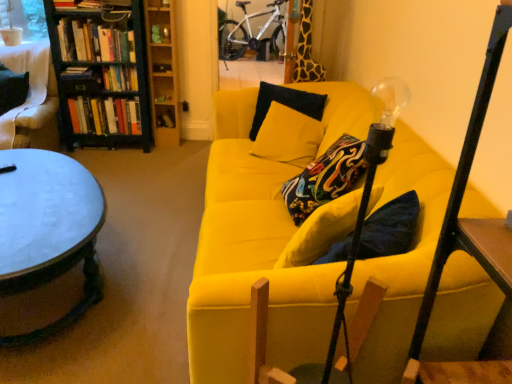
Question: Can you confirm if metallic round table at left is shorter than white matte bicycle at upper center?

Choices:
 (A) no
 (B) yes

Answer: (B)

Question: Is metallic round table at left at the right side of white matte bicycle at upper center?

Choices:
 (A) yes
 (B) no

Answer: (B)

Question: Does metallic round table at left have a larger size compared to white matte bicycle at upper center?

Choices:
 (A) yes
 (B) no

Answer: (B)

Question: Is white matte bicycle at upper center surrounded by metallic round table at left?

Choices:
 (A) no
 (B) yes

Answer: (A)

Question: Is white matte bicycle at upper center at the back of metallic round table at left?

Choices:
 (A) yes
 (B) no

Answer: (B)

Question: Is metallic round table at left in contact with white matte bicycle at upper center?

Choices:
 (A) no
 (B) yes

Answer: (A)

Question: Is hardcover book at center, marked as the fifth book in a top-to-bottom arrangement, at the back of hardcover books at upper left, which is counted as the first book, starting from the top?

Choices:
 (A) yes
 (B) no

Answer: (B)

Question: Does hardcover books at upper left, which is counted as the first book, starting from the top, touch hardcover book at center, marked as the 1th book in a bottom-to-top arrangement?

Choices:
 (A) no
 (B) yes

Answer: (A)

Question: Can you confirm if hardcover books at upper left, which is counted as the first book, starting from the top, is bigger than hardcover book at center, marked as the fifth book in a top-to-bottom arrangement?

Choices:
 (A) no
 (B) yes

Answer: (B)

Question: Is hardcover books at upper left, which is counted as the first book, starting from the top, far from hardcover book at center, marked as the 1th book in a bottom-to-top arrangement?

Choices:
 (A) yes
 (B) no

Answer: (B)

Question: Considering the relative sizes of hardcover books at upper left, which is counted as the first book, starting from the top, and hardcover book at center, marked as the fifth book in a top-to-bottom arrangement, in the image provided, is hardcover books at upper left, which is counted as the first book, starting from the top, thinner than hardcover book at center, marked as the fifth book in a top-to-bottom arrangement,?

Choices:
 (A) yes
 (B) no

Answer: (B)

Question: From the image's perspective, would you say hardcover books at upper left, which is counted as the first book, starting from the top, is positioned over hardcover book at center, marked as the 1th book in a bottom-to-top arrangement?

Choices:
 (A) yes
 (B) no

Answer: (A)

Question: Is hardcover book at upper center, which appears as the 2th book when viewed from the top, outside of hardcover books at upper left, which is counted as the first book, starting from the top?

Choices:
 (A) yes
 (B) no

Answer: (A)